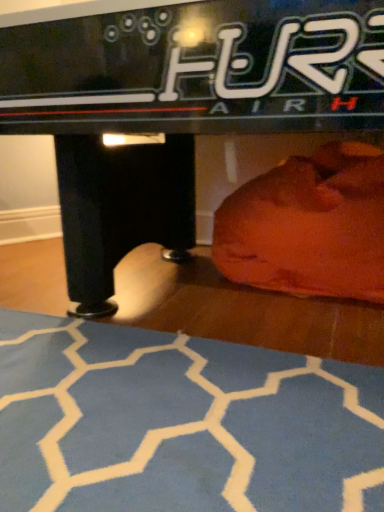
Question: From a real-world perspective, is black glossy air hockey table at center physically above orange fabric bean bag at lower right?

Choices:
 (A) yes
 (B) no

Answer: (A)

Question: From the image's perspective, is black glossy air hockey table at center below orange fabric bean bag at lower right?

Choices:
 (A) yes
 (B) no

Answer: (B)

Question: Could you tell me if black glossy air hockey table at center is facing orange fabric bean bag at lower right?

Choices:
 (A) yes
 (B) no

Answer: (B)

Question: Is black glossy air hockey table at center bigger than orange fabric bean bag at lower right?

Choices:
 (A) no
 (B) yes

Answer: (B)

Question: From the image's perspective, would you say black glossy air hockey table at center is positioned over orange fabric bean bag at lower right?

Choices:
 (A) no
 (B) yes

Answer: (B)

Question: Is black glossy air hockey table at center in front of or behind blue textured yoga mat at lower center in the image?

Choices:
 (A) behind
 (B) front

Answer: (A)

Question: Is black glossy air hockey table at center to the left or to the right of blue textured yoga mat at lower center in the image?

Choices:
 (A) right
 (B) left

Answer: (A)

Question: From a real-world perspective, is black glossy air hockey table at center positioned above or below blue textured yoga mat at lower center?

Choices:
 (A) above
 (B) below

Answer: (A)

Question: Considering the positions of black glossy air hockey table at center and blue textured yoga mat at lower center in the image, is black glossy air hockey table at center taller or shorter than blue textured yoga mat at lower center?

Choices:
 (A) tall
 (B) short

Answer: (A)

Question: Based on their positions, is orange fabric bean bag at lower right located to the left or right of blue textured yoga mat at lower center?

Choices:
 (A) left
 (B) right

Answer: (B)

Question: Choose the correct answer: Is orange fabric bean bag at lower right inside blue textured yoga mat at lower center or outside it?

Choices:
 (A) inside
 (B) outside

Answer: (B)

Question: Considering the positions of orange fabric bean bag at lower right and blue textured yoga mat at lower center in the image, is orange fabric bean bag at lower right taller or shorter than blue textured yoga mat at lower center?

Choices:
 (A) tall
 (B) short

Answer: (A)

Question: Relative to blue textured yoga mat at lower center, is orange fabric bean bag at lower right in front or behind?

Choices:
 (A) behind
 (B) front

Answer: (A)

Question: Is blue textured yoga mat at lower center to the left or to the right of orange fabric bean bag at lower right in the image?

Choices:
 (A) left
 (B) right

Answer: (A)

Question: Is blue textured yoga mat at lower center wider or thinner than orange fabric bean bag at lower right?

Choices:
 (A) wide
 (B) thin

Answer: (A)